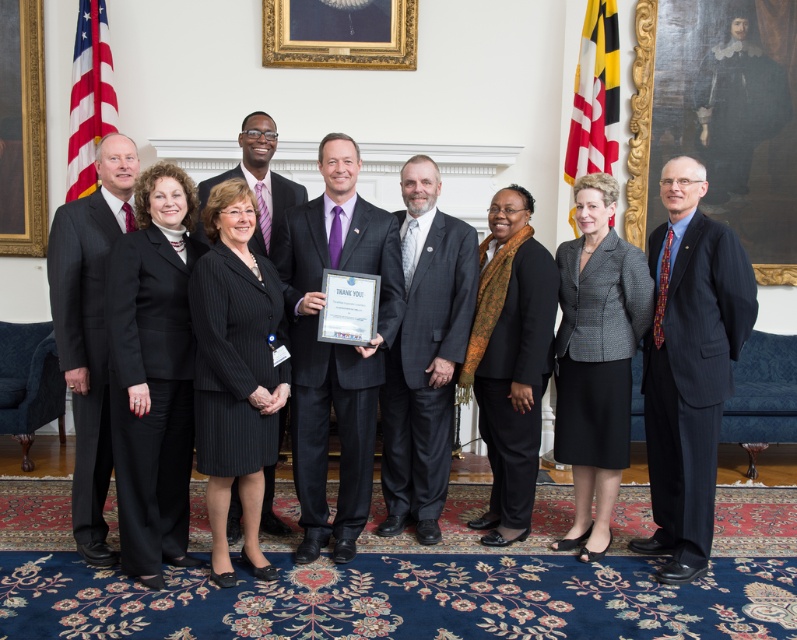
In the group photo, you notice the black matte suit at center and the red fabric flag at upper right. Which object takes up more space in the image?

The black matte suit at center has a larger size compared to the red fabric flag at upper right, so it takes up more space in the image.

You are standing at point (x=607, y=1) and want to walk to the front of the room. Which direction should you move relative to point (x=132, y=333)?

You should move towards point (x=132, y=333) because it is in front of your current position at point (x=607, y=1).